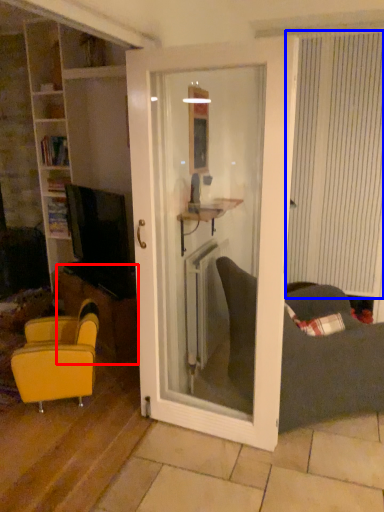
Question: Among these objects, which one is nearest to the camera, table (highlighted by a red box) or curtain (highlighted by a blue box)?

Choices:
 (A) table
 (B) curtain

Answer: (B)